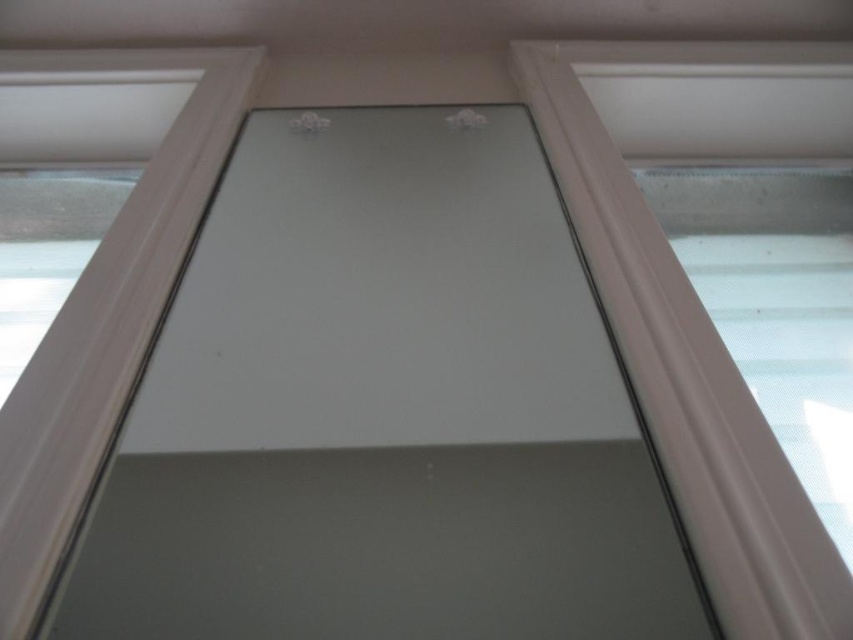
Does white plastic window frame at right have a larger size compared to white plastic window frame at upper left?

Yes.

Measure the distance between white plastic window frame at right and white plastic window frame at upper left.

white plastic window frame at right and white plastic window frame at upper left are 22.75 inches apart from each other.

The height and width of the screenshot is (640, 853). In order to click on white plastic window frame at right in this screenshot , I will do `click(688, 369)`.